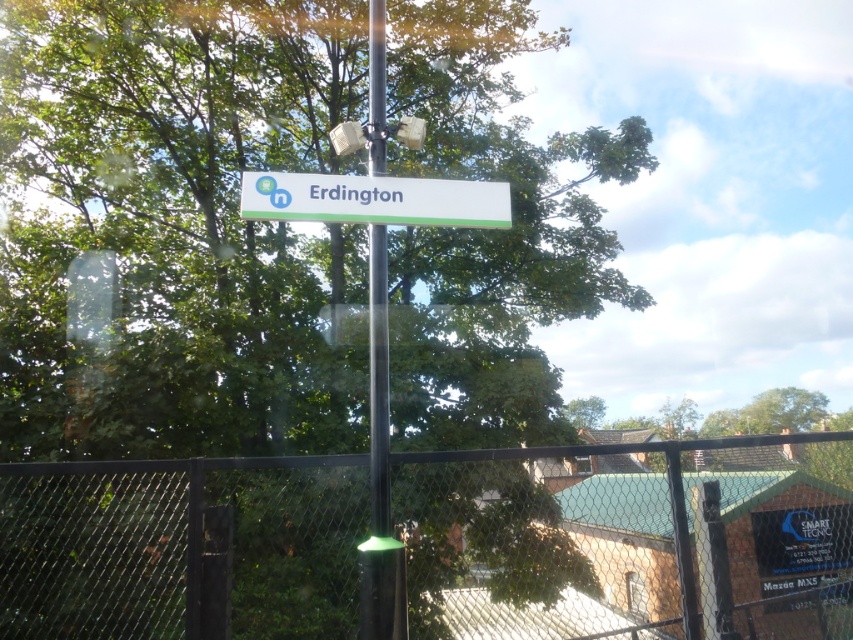
Question: Among these points, which one is farthest from the camera?

Choices:
 (A) (461, 227)
 (B) (387, 547)

Answer: (A)

Question: Which point is closer to the camera taking this photo?

Choices:
 (A) coord(387,429)
 (B) coord(315,180)

Answer: (A)

Question: Can you confirm if black chain-link fence at center is positioned below black metallic pole at center?

Choices:
 (A) no
 (B) yes

Answer: (B)

Question: Does black chain-link fence at center come in front of black metallic pole at center?

Choices:
 (A) yes
 (B) no

Answer: (B)

Question: Which object is farther from the camera taking this photo?

Choices:
 (A) white plastic sign at center
 (B) black chain-link fence at center
 (C) black metallic pole at center

Answer: (A)

Question: Can you confirm if black chain-link fence at center is positioned to the left of black metallic pole at center?

Choices:
 (A) yes
 (B) no

Answer: (B)